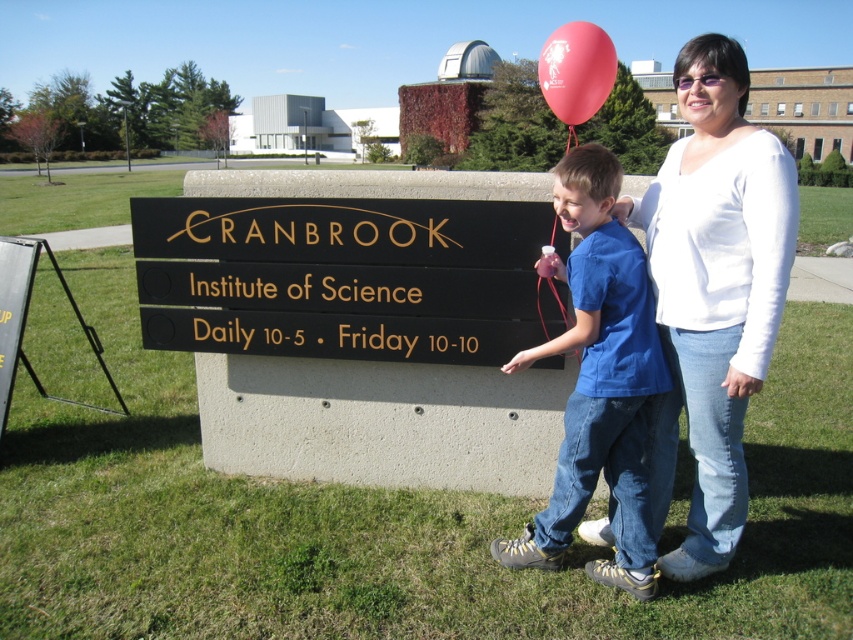
Question: Which object is positioned farthest from the black polished wood sign at center?

Choices:
 (A) blue cotton shirt at center
 (B) rubber balloon at upper center

Answer: (B)

Question: Which object appears farthest from the camera in this image?

Choices:
 (A) rubber balloon at upper center
 (B) black polished wood sign at center
 (C) white smooth shirt at upper right
 (D) blue cotton shirt at center

Answer: (A)

Question: Can you confirm if black polished wood sign at center is positioned below rubber balloon at upper center?

Choices:
 (A) yes
 (B) no

Answer: (A)

Question: Does black polished wood sign at center have a lesser width compared to white smooth shirt at upper right?

Choices:
 (A) yes
 (B) no

Answer: (B)

Question: Is white smooth shirt at upper right to the left of rubber balloon at upper center from the viewer's perspective?

Choices:
 (A) yes
 (B) no

Answer: (A)

Question: Which object is the farthest from the black polished wood sign at center?

Choices:
 (A) blue cotton shirt at center
 (B) white smooth shirt at upper right
 (C) rubber balloon at upper center

Answer: (C)